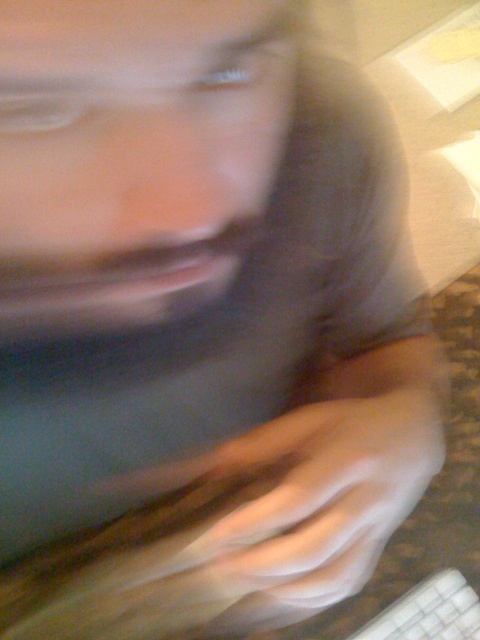
Does smooth skin hand at center have a greater width compared to white plastic keyboard at lower right?

Yes.

Does smooth skin hand at center appear on the right side of white plastic keyboard at lower right?

No, smooth skin hand at center is not to the right of white plastic keyboard at lower right.

Is point (324, 456) closer to camera compared to point (476, 600)?

Yes, it is.

Find the location of a particular element. The image size is (480, 640). smooth skin hand at center is located at coordinates (331, 490).